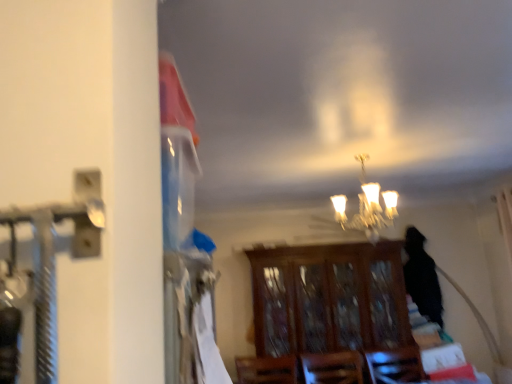
Locate an element on the screen. The height and width of the screenshot is (384, 512). wooden cabinet at center is located at coordinates (335, 304).

What do you see at coordinates (335, 304) in the screenshot? This screenshot has width=512, height=384. I see `wooden cabinet at center` at bounding box center [335, 304].

Describe the element at coordinates (367, 207) in the screenshot. This screenshot has height=384, width=512. I see `matte glass chandelier at center` at that location.

What is the approximate width of matte glass chandelier at center?

matte glass chandelier at center is 18.81 inches in width.

Identify the location of matte glass chandelier at center. The image size is (512, 384). (367, 207).

You are a GUI agent. You are given a task and a screenshot of the screen. Output one action in this format:
    pyautogui.click(x=<x>, y=<y>)
    Task: Click on the wooden cabinet at center
    
    Given the screenshot: What is the action you would take?
    pyautogui.click(x=335, y=304)

Which is more to the right, matte glass chandelier at center or wooden cabinet at center?

wooden cabinet at center.

Between matte glass chandelier at center and wooden cabinet at center, which one is positioned in front?

matte glass chandelier at center.

Is point (372, 183) farther from camera compared to point (328, 304)?

No, it is not.

From the image's perspective, which one is positioned higher, matte glass chandelier at center or wooden cabinet at center?

matte glass chandelier at center.

From a real-world perspective, is matte glass chandelier at center located beneath wooden cabinet at center?

Incorrect, from a real-world perspective, matte glass chandelier at center is higher than wooden cabinet at center.

Does matte glass chandelier at center have a lesser width compared to wooden cabinet at center?

Indeed, matte glass chandelier at center has a lesser width compared to wooden cabinet at center.

Which of these two, matte glass chandelier at center or wooden cabinet at center, stands shorter?

Standing shorter between the two is matte glass chandelier at center.

Can you confirm if matte glass chandelier at center is bigger than wooden cabinet at center?

No, matte glass chandelier at center is not bigger than wooden cabinet at center.

Would you say matte glass chandelier at center contains wooden cabinet at center?

No, wooden cabinet at center is not inside matte glass chandelier at center.

Is matte glass chandelier at center directly adjacent to wooden cabinet at center?

No, matte glass chandelier at center is not with wooden cabinet at center.

Is matte glass chandelier at center aimed at wooden cabinet at center?

No.

How far apart are matte glass chandelier at center and wooden cabinet at center?

matte glass chandelier at center and wooden cabinet at center are 1.15 meters apart from each other.

Where is `furniture below the matte glass chandelier at center (from a real-world perspective)`? furniture below the matte glass chandelier at center (from a real-world perspective) is located at coordinates (335, 304).

Is wooden cabinet at center to the left of matte glass chandelier at center from the viewer's perspective?

No.

Considering their positions, is wooden cabinet at center located in front of or behind matte glass chandelier at center?

Visually, wooden cabinet at center is located behind matte glass chandelier at center.

Is point (282, 354) closer to viewer compared to point (350, 224)?

No, (282, 354) is further to viewer.

From the image's perspective, which is above, wooden cabinet at center or matte glass chandelier at center?

matte glass chandelier at center appears higher in the image.

From a real-world perspective, is wooden cabinet at center located beneath matte glass chandelier at center?

Correct, in the physical world, wooden cabinet at center is lower than matte glass chandelier at center.

Which object is wider, wooden cabinet at center or matte glass chandelier at center?

wooden cabinet at center is wider.

Between wooden cabinet at center and matte glass chandelier at center, which one has more height?

wooden cabinet at center.

Does wooden cabinet at center have a smaller size compared to matte glass chandelier at center?

Actually, wooden cabinet at center might be larger than matte glass chandelier at center.

Is wooden cabinet at center inside or outside of matte glass chandelier at center?

wooden cabinet at center is not enclosed by matte glass chandelier at center.

Are wooden cabinet at center and matte glass chandelier at center far apart?

Yes, wooden cabinet at center and matte glass chandelier at center are quite far apart.

Could you tell me if wooden cabinet at center is turned towards matte glass chandelier at center?

Yes, wooden cabinet at center is turned towards matte glass chandelier at center.

What's the angular difference between wooden cabinet at center and matte glass chandelier at center's facing directions?

The angular difference between wooden cabinet at center and matte glass chandelier at center is 89.6 degrees.

The image size is (512, 384). Identify the location of furniture directly beneath the matte glass chandelier at center (from a real-world perspective). (335, 304).

Find the location of `lamp in front of the wooden cabinet at center`. lamp in front of the wooden cabinet at center is located at coordinates (367, 207).

Locate an element on the screen. This screenshot has width=512, height=384. furniture on the right of the matte glass chandelier at center is located at coordinates (335, 304).